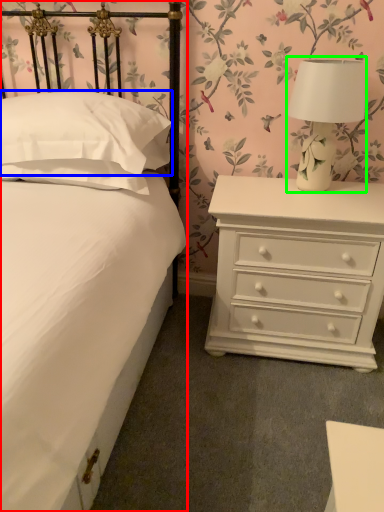
Question: Based on their relative distances, which object is nearer to bed (highlighted by a red box)? Choose from pillow (highlighted by a blue box) and table lamp (highlighted by a green box).

Choices:
 (A) pillow
 (B) table lamp

Answer: (A)